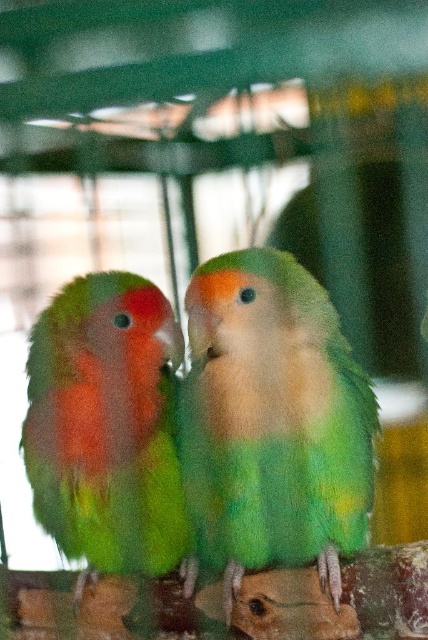
Is green feathered parrot at center shorter than green matte parrot at left?

In fact, green feathered parrot at center may be taller than green matte parrot at left.

Can you confirm if green feathered parrot at center is smaller than green matte parrot at left?

No, green feathered parrot at center is not smaller than green matte parrot at left.

Describe the element at coordinates (273, 422) in the screenshot. I see `green feathered parrot at center` at that location.

The width and height of the screenshot is (428, 640). I want to click on green feathered parrot at center, so click(x=273, y=422).